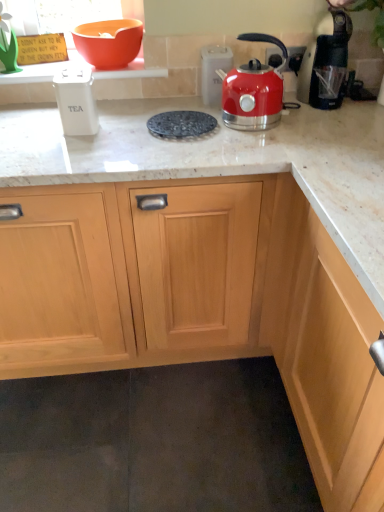
Find the location of a particular element. The image size is (384, 512). free space in front of white plastic tea container at left, the 1th kitchen appliance viewed from the left is located at coordinates (66, 156).